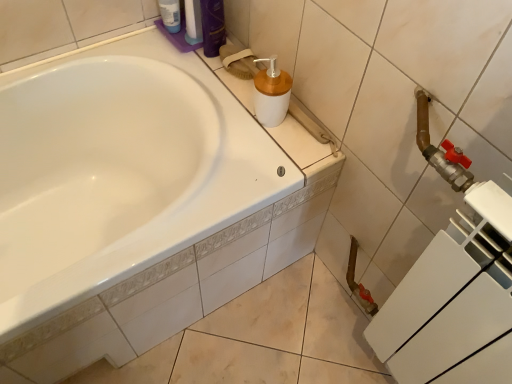
Question: Is there a large distance between shiny purple bottle at upper center, which is the 1th toiletry from right to left, and white matte plastic soap dispenser at upper center?

Choices:
 (A) no
 (B) yes

Answer: (A)

Question: Is shiny purple bottle at upper center, which is the 1th toiletry from right to left, aimed at white matte plastic soap dispenser at upper center?

Choices:
 (A) yes
 (B) no

Answer: (A)

Question: Can you confirm if shiny purple bottle at upper center, which is the 1th toiletry from right to left, is taller than white matte plastic soap dispenser at upper center?

Choices:
 (A) yes
 (B) no

Answer: (A)

Question: Can you confirm if shiny purple bottle at upper center, positioned as the second toiletry in left-to-right order, is smaller than white matte plastic soap dispenser at upper center?

Choices:
 (A) no
 (B) yes

Answer: (B)

Question: Is shiny purple bottle at upper center, positioned as the second toiletry in left-to-right order, to the left of white matte plastic soap dispenser at upper center from the viewer's perspective?

Choices:
 (A) yes
 (B) no

Answer: (A)

Question: Is point (264, 77) positioned closer to the camera than point (173, 24)?

Choices:
 (A) closer
 (B) farther

Answer: (A)

Question: Is white matte plastic soap dispenser at upper center bigger or smaller than translucent plastic bottle at upper left, the second toiletry positioned from the right?

Choices:
 (A) small
 (B) big

Answer: (B)

Question: Considering the positions of white matte plastic soap dispenser at upper center and translucent plastic bottle at upper left, the first toiletry when ordered from left to right, in the image, is white matte plastic soap dispenser at upper center wider or thinner than translucent plastic bottle at upper left, the first toiletry when ordered from left to right,?

Choices:
 (A) wide
 (B) thin

Answer: (A)

Question: Is white matte plastic soap dispenser at upper center in front of or behind translucent plastic bottle at upper left, the first toiletry when ordered from left to right, in the image?

Choices:
 (A) behind
 (B) front

Answer: (B)

Question: Is white matte plastic soap dispenser at upper center to the left or to the right of shiny purple bottle at upper center, which is the 1th toiletry from right to left, in the image?

Choices:
 (A) left
 (B) right

Answer: (B)

Question: From a real-world perspective, is white matte plastic soap dispenser at upper center physically located above or below shiny purple bottle at upper center, which is the 1th toiletry from right to left?

Choices:
 (A) above
 (B) below

Answer: (B)

Question: In terms of size, does white matte plastic soap dispenser at upper center appear bigger or smaller than shiny purple bottle at upper center, positioned as the second toiletry in left-to-right order?

Choices:
 (A) big
 (B) small

Answer: (A)

Question: From their relative heights in the image, would you say white matte plastic soap dispenser at upper center is taller or shorter than shiny purple bottle at upper center, positioned as the second toiletry in left-to-right order?

Choices:
 (A) short
 (B) tall

Answer: (A)

Question: Do you think shiny purple bottle at upper center, positioned as the second toiletry in left-to-right order, is within translucent plastic bottle at upper left, the second toiletry positioned from the right, or outside of it?

Choices:
 (A) inside
 (B) outside

Answer: (B)

Question: Considering the positions of shiny purple bottle at upper center, which is the 1th toiletry from right to left, and translucent plastic bottle at upper left, the first toiletry when ordered from left to right, in the image, is shiny purple bottle at upper center, which is the 1th toiletry from right to left, wider or thinner than translucent plastic bottle at upper left, the first toiletry when ordered from left to right,?

Choices:
 (A) wide
 (B) thin

Answer: (A)